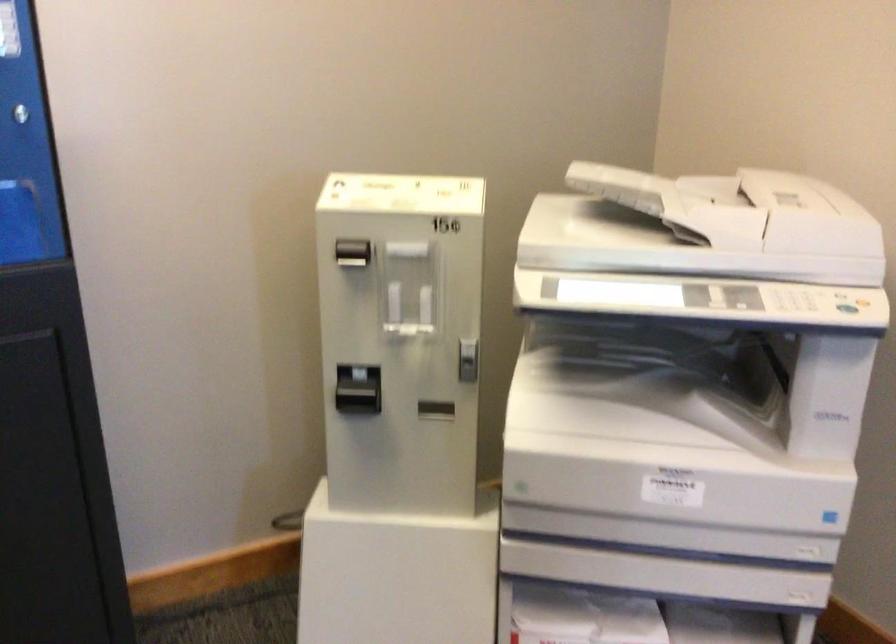
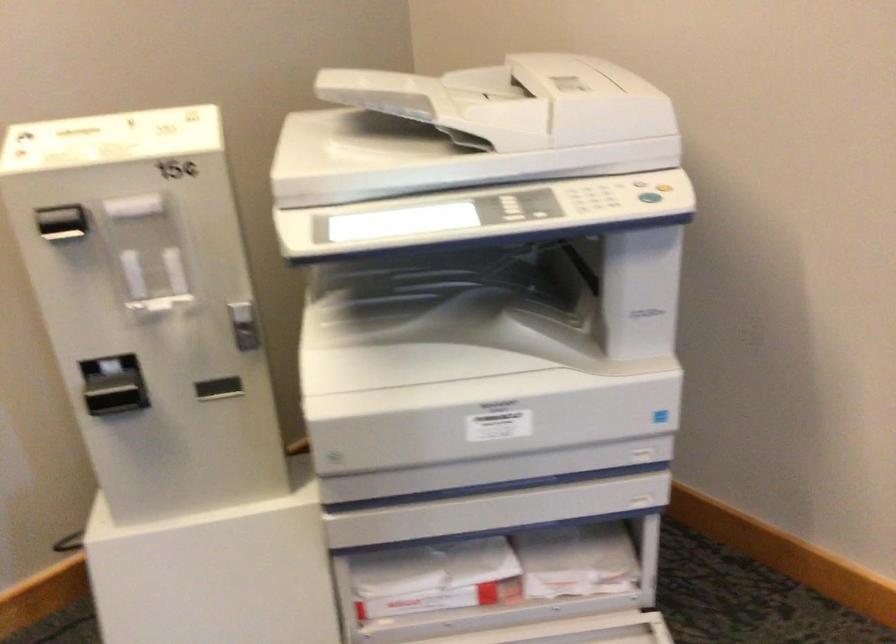
Locate, in the second image, the point that corresponds to [688,225] in the first image.

(470, 129)